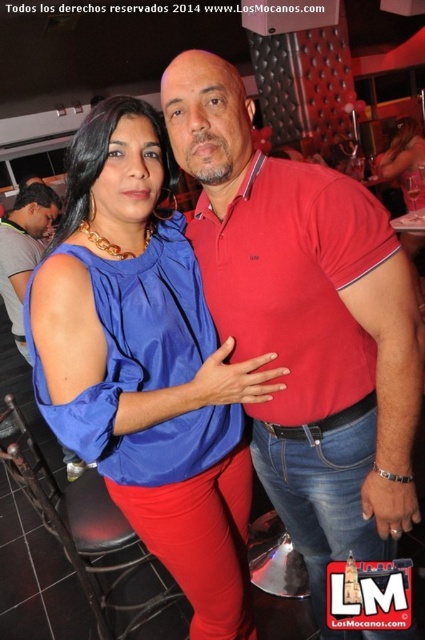
You are at a party and want to take a photo with both the red cotton polo shirt at center and the gray fabric shirt at left. Which shirt should you position closer to the camera to ensure both are fully visible in the photo?

The red cotton polo shirt at center is taller than the gray fabric shirt at left, so positioning the gray fabric shirt at left closer to the camera would help ensure both shirts are fully visible in the photo.

You are organizing a charity event and need to decide which of the two shirts, the red cotton polo shirt at center or the gray fabric shirt at left, can fit better into a display mannequin with a 20 cm shoulder width. Based on their widths, which shirt would you choose?

The red cotton polo shirt at center has a greater width than the gray fabric shirt at left, so it would better fit the display mannequin with a 20 cm shoulder width if the red cotton polo shirt at center is wider than 20 cm. However, if the gray fabric shirt at left is closer to 20 cm, it might be a better fit. The description only states the red is wider than the gray, but without exact measurements, it is unclear which is closer to 20 cm. Therefore, more information is needed to determine the best fit.